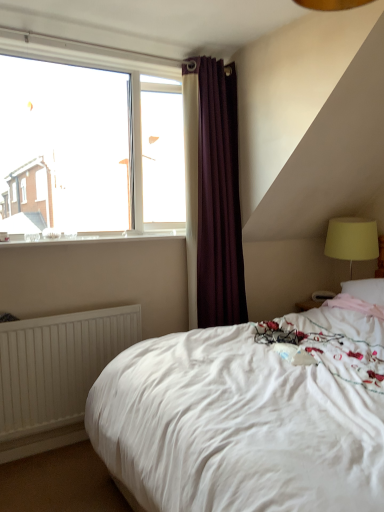
Question: Is white glossy window sill at upper left turned away from white matte radiator at lower left?

Choices:
 (A) no
 (B) yes

Answer: (A)

Question: Considering the relative positions of white glossy window sill at upper left and white matte radiator at lower left in the image provided, is white glossy window sill at upper left to the left of white matte radiator at lower left from the viewer's perspective?

Choices:
 (A) yes
 (B) no

Answer: (B)

Question: From the image's perspective, is white glossy window sill at upper left over white matte radiator at lower left?

Choices:
 (A) no
 (B) yes

Answer: (B)

Question: Considering the relative sizes of white glossy window sill at upper left and white matte radiator at lower left in the image provided, is white glossy window sill at upper left smaller than white matte radiator at lower left?

Choices:
 (A) no
 (B) yes

Answer: (B)

Question: From a real-world perspective, does white glossy window sill at upper left stand above white matte radiator at lower left?

Choices:
 (A) yes
 (B) no

Answer: (A)

Question: Considering the positions of point (367, 254) and point (170, 220), is point (367, 254) closer or farther from the camera than point (170, 220)?

Choices:
 (A) closer
 (B) farther

Answer: (B)

Question: Do you think yellow fabric lampshade at right is within clear glass window at upper left, or outside of it?

Choices:
 (A) inside
 (B) outside

Answer: (B)

Question: Considering the relative positions of yellow fabric lampshade at right and clear glass window at upper left in the image provided, is yellow fabric lampshade at right to the left or to the right of clear glass window at upper left?

Choices:
 (A) right
 (B) left

Answer: (A)

Question: From their relative heights in the image, would you say yellow fabric lampshade at right is taller or shorter than clear glass window at upper left?

Choices:
 (A) short
 (B) tall

Answer: (A)

Question: Looking at their shapes, would you say white glossy window sill at upper left is wider or thinner than clear glass window at upper left?

Choices:
 (A) thin
 (B) wide

Answer: (B)

Question: From their relative heights in the image, would you say white glossy window sill at upper left is taller or shorter than clear glass window at upper left?

Choices:
 (A) short
 (B) tall

Answer: (A)

Question: From a real-world perspective, is white glossy window sill at upper left physically located above or below clear glass window at upper left?

Choices:
 (A) above
 (B) below

Answer: (B)

Question: Is white glossy window sill at upper left to the left or to the right of clear glass window at upper left in the image?

Choices:
 (A) right
 (B) left

Answer: (A)

Question: Considering the relative positions of clear glass window at upper left and yellow fabric lampshade at right in the image provided, is clear glass window at upper left to the left or to the right of yellow fabric lampshade at right?

Choices:
 (A) right
 (B) left

Answer: (B)

Question: Do you think clear glass window at upper left is within yellow fabric lampshade at right, or outside of it?

Choices:
 (A) outside
 (B) inside

Answer: (A)